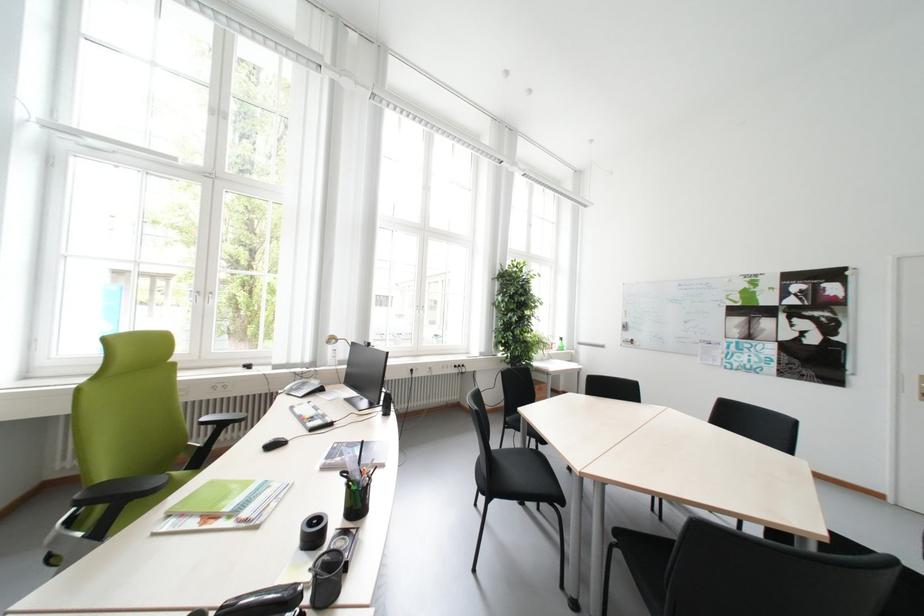
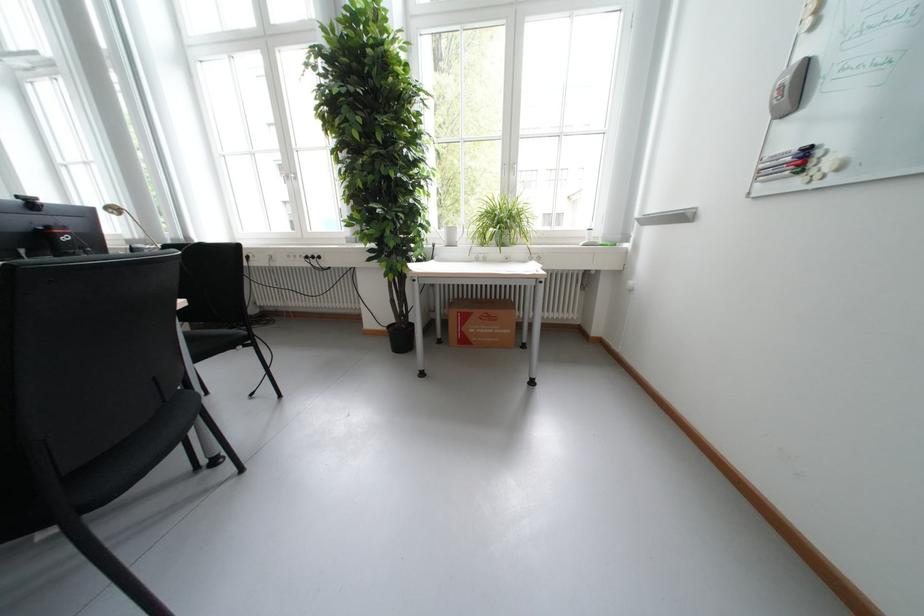
Where in the second image is the point corresponding to the point at 468,368 from the first image?

(322, 257)